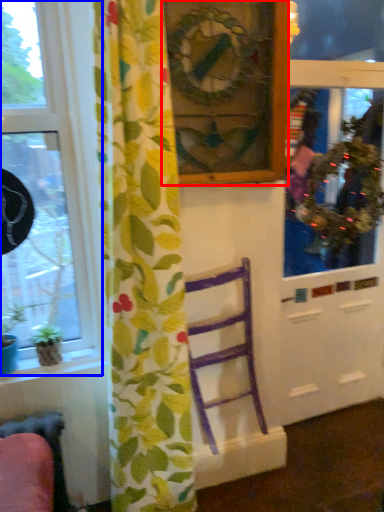
Question: Which object appears farthest to the camera in this image, picture frame (highlighted by a red box) or window (highlighted by a blue box)?

Choices:
 (A) picture frame
 (B) window

Answer: (A)